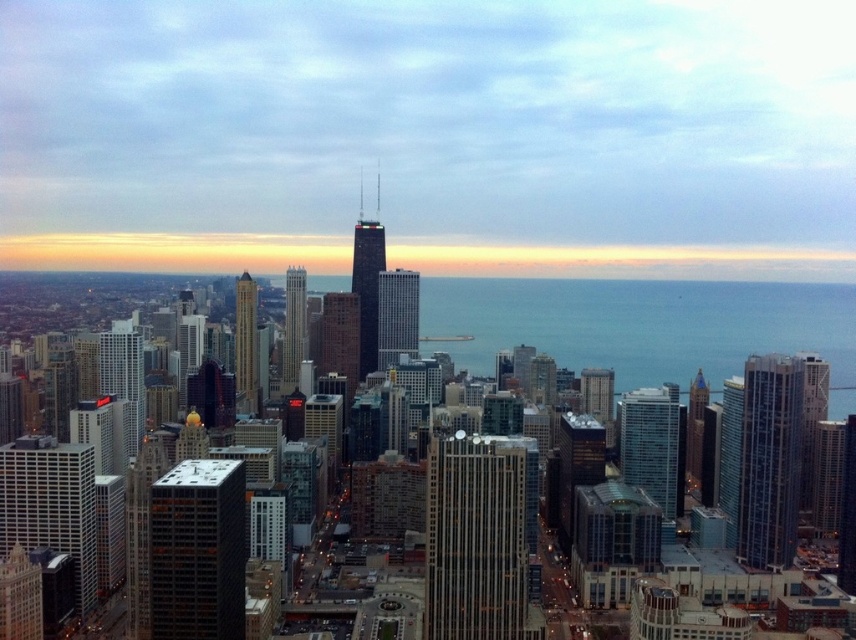
Locate an element on the screen. This screenshot has width=856, height=640. glassy steel skyscraper at right is located at coordinates (770, 460).

Is glassy steel skyscraper at right to the left of matte glass skyscraper at center from the viewer's perspective?

Incorrect, glassy steel skyscraper at right is not on the left side of matte glass skyscraper at center.

Is point (785, 496) farther from viewer compared to point (355, 369)?

Yes, it is behind point (355, 369).

Locate an element on the screen. The height and width of the screenshot is (640, 856). glassy steel skyscraper at right is located at coordinates (770, 460).

Which of these two, matte glass skyscraper at left or shiny glass skyscraper at left, stands shorter?

shiny glass skyscraper at left

Which is behind, point (122, 392) or point (254, 365)?

The point (122, 392) is behind.

This screenshot has height=640, width=856. Find the location of `matte glass skyscraper at left`. matte glass skyscraper at left is located at coordinates (123, 372).

The image size is (856, 640). I want to click on matte glass skyscraper at left, so click(123, 372).

Who is higher up, blue water at center or dark glass skyscraper at center?

blue water at center

Image resolution: width=856 pixels, height=640 pixels. In order to click on blue water at center in this screenshot , I will do `click(643, 324)`.

Locate an element on the screen. This screenshot has height=640, width=856. blue water at center is located at coordinates (643, 324).